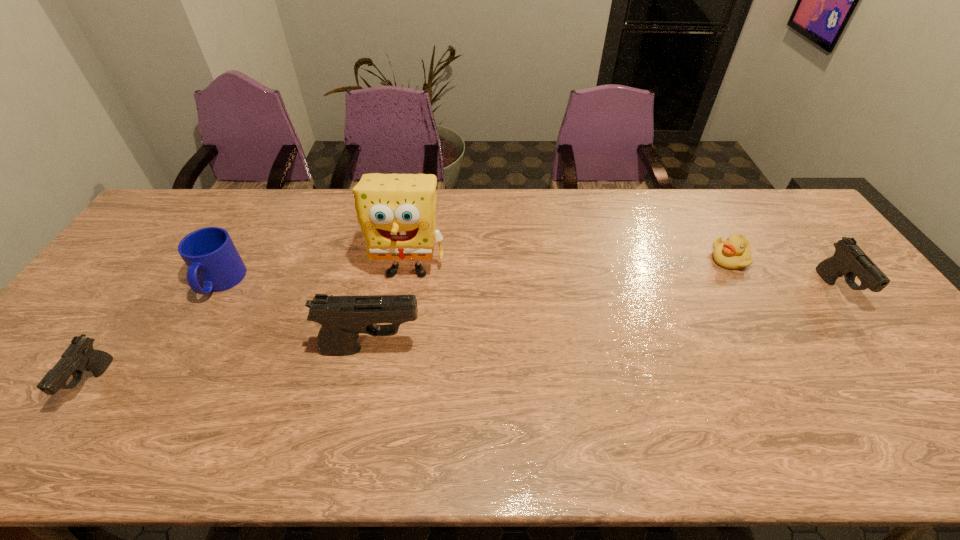
Locate an element on the screen. the leftmost pistol is located at coordinates (79, 356).

Locate an element on the screen. This screenshot has width=960, height=540. the fifth tallest object is located at coordinates (79, 356).

Find the location of a particular element. The height and width of the screenshot is (540, 960). the tallest pistol is located at coordinates (343, 318).

What are the coordinates of `the second pistol from right to left` in the screenshot? It's located at click(x=343, y=318).

This screenshot has width=960, height=540. Identify the location of the farthest pistol. (849, 260).

You are a GUI agent. You are given a task and a screenshot of the screen. Output one action in this format:
    pyautogui.click(x=<x>, y=<y>)
    Task: Click on the rightmost object
    The image size is (960, 540).
    Given the screenshot: What is the action you would take?
    pyautogui.click(x=849, y=260)

Locate an element on the screen. The height and width of the screenshot is (540, 960). the fifth object from right to left is located at coordinates (213, 262).

Find the location of `the shortest object`. the shortest object is located at coordinates (735, 252).

The width and height of the screenshot is (960, 540). In order to click on the second object from right to left in this screenshot , I will do `click(735, 252)`.

Where is `sponge`? Image resolution: width=960 pixels, height=540 pixels. sponge is located at coordinates (397, 212).